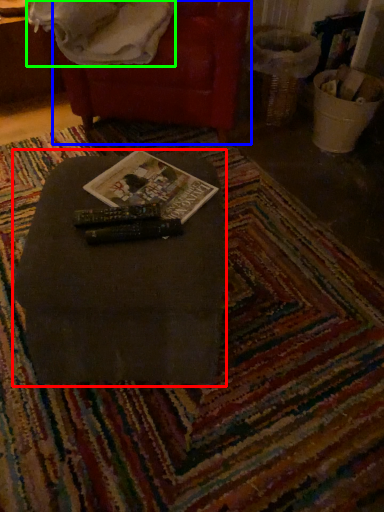
Question: Considering the real-world distances, which object is farthest from table (highlighted by a red box)? bean bag chair (highlighted by a blue box) or blanket (highlighted by a green box)?

Choices:
 (A) bean bag chair
 (B) blanket

Answer: (B)